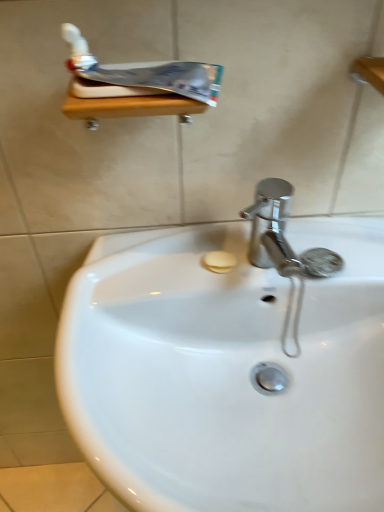
Describe the element at coordinates (139, 75) in the screenshot. Image resolution: width=384 pixels, height=512 pixels. I see `white glossy toothpaste at upper left` at that location.

Find the location of `white glossy toothpaste at upper left`. white glossy toothpaste at upper left is located at coordinates (139, 75).

The height and width of the screenshot is (512, 384). What do you see at coordinates (230, 365) in the screenshot?
I see `white glossy sink at center` at bounding box center [230, 365].

In order to click on white glossy sink at center in this screenshot , I will do `click(230, 365)`.

You are a GUI agent. You are given a task and a screenshot of the screen. Output one action in this format:
    pyautogui.click(x=<x>, y=<y>)
    Task: Click on the white glossy toothpaste at upper left
    Image resolution: width=384 pixels, height=512 pixels.
    Given the screenshot: What is the action you would take?
    pyautogui.click(x=139, y=75)

Does white glossy toothpaste at upper left appear on the left side of white glossy sink at center?

Indeed, white glossy toothpaste at upper left is positioned on the left side of white glossy sink at center.

Is white glossy toothpaste at upper left positioned before white glossy sink at center?

No, white glossy toothpaste at upper left is behind white glossy sink at center.

Considering the positions of points (133, 92) and (339, 256), is point (133, 92) closer to camera compared to point (339, 256)?

Yes, point (133, 92) is closer to viewer.

From the image's perspective, which object appears higher, white glossy toothpaste at upper left or white glossy sink at center?

white glossy toothpaste at upper left is shown above in the image.

From a real-world perspective, which is physically below, white glossy toothpaste at upper left or white glossy sink at center?

white glossy sink at center is physically lower.

Does white glossy toothpaste at upper left have a greater width compared to white glossy sink at center?

No.

Considering the sizes of white glossy toothpaste at upper left and white glossy sink at center in the image, is white glossy toothpaste at upper left taller or shorter than white glossy sink at center?

Clearly, white glossy toothpaste at upper left is shorter compared to white glossy sink at center.

Can you confirm if white glossy toothpaste at upper left is bigger than white glossy sink at center?

No.

Is white glossy toothpaste at upper left not inside white glossy sink at center?

Indeed, white glossy toothpaste at upper left is completely outside white glossy sink at center.

Is white glossy toothpaste at upper left placed right next to white glossy sink at center?

No, white glossy toothpaste at upper left is not with white glossy sink at center.

Is white glossy toothpaste at upper left turned away from white glossy sink at center?

white glossy toothpaste at upper left is not turned away from white glossy sink at center.

This screenshot has height=512, width=384. I want to click on sink below the white glossy toothpaste at upper left (from the image's perspective), so click(230, 365).

Would you say white glossy sink at center is to the left or to the right of white glossy toothpaste at upper left in the picture?

Based on their positions, white glossy sink at center is located to the right of white glossy toothpaste at upper left.

Which object is closer to the camera, white glossy sink at center or white glossy toothpaste at upper left?

white glossy sink at center is more forward.

Which is behind, point (189, 369) or point (112, 92)?

Positioned behind is point (189, 369).

From the image's perspective, is white glossy sink at center above white glossy toothpaste at upper left?

Actually, white glossy sink at center appears below white glossy toothpaste at upper left in the image.

From a real-world perspective, who is located lower, white glossy sink at center or white glossy toothpaste at upper left?

white glossy sink at center, from a real-world perspective.

Which object is wider, white glossy sink at center or white glossy toothpaste at upper left?

Wider between the two is white glossy sink at center.

Between white glossy sink at center and white glossy toothpaste at upper left, which one has less height?

With less height is white glossy toothpaste at upper left.

Considering the relative sizes of white glossy sink at center and white glossy toothpaste at upper left in the image provided, is white glossy sink at center bigger than white glossy toothpaste at upper left?

Yes, white glossy sink at center is bigger than white glossy toothpaste at upper left.

Would you say white glossy sink at center is outside white glossy toothpaste at upper left?

Yes, white glossy sink at center is not within white glossy toothpaste at upper left.

Would you consider white glossy sink at center to be distant from white glossy toothpaste at upper left?

No, there isn't a large distance between white glossy sink at center and white glossy toothpaste at upper left.

Is white glossy sink at center facing towards white glossy toothpaste at upper left?

No, white glossy sink at center is not facing towards white glossy toothpaste at upper left.

What's the angular difference between white glossy sink at center and white glossy toothpaste at upper left's facing directions?

3.81 degrees.

Locate an element on the screen. sink that appears on the right of white glossy toothpaste at upper left is located at coordinates tap(230, 365).

At what (x,y) coordinates should I click in order to perform the action: click on sink below the white glossy toothpaste at upper left (from the image's perspective). Please return your answer as a coordinate pair (x, y). Looking at the image, I should click on tap(230, 365).

In order to click on sink below the white glossy toothpaste at upper left (from a real-world perspective) in this screenshot , I will do `click(230, 365)`.